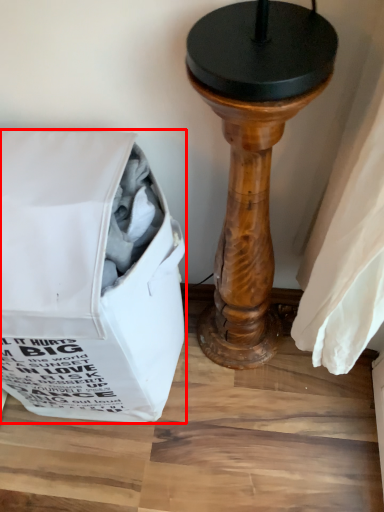
Question: Observing the image, what is the correct spatial positioning of bag (annotated by the red box) in reference to furniture?

Choices:
 (A) left
 (B) right

Answer: (A)